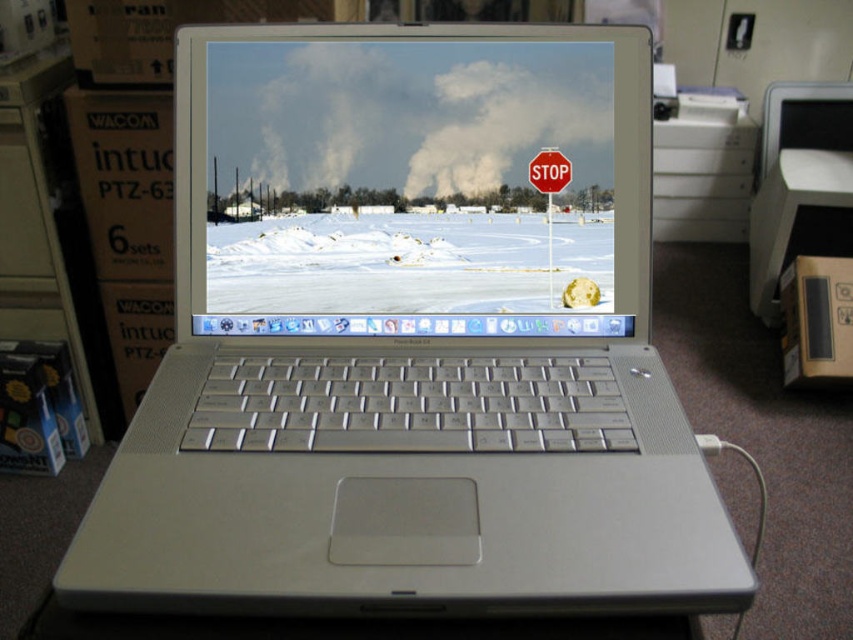
Question: Observing the image, what is the correct spatial positioning of matte plastic screen at center in reference to metallic red stop sign at center?

Choices:
 (A) below
 (B) above

Answer: (A)

Question: Among these points, which one is nearest to the camera?

Choices:
 (A) (556, 230)
 (B) (554, 186)

Answer: (B)

Question: Does matte plastic screen at center come behind metallic red stop sign at center?

Choices:
 (A) yes
 (B) no

Answer: (A)

Question: Is matte plastic screen at center in front of metallic red stop sign at center?

Choices:
 (A) yes
 (B) no

Answer: (B)

Question: Which object appears closest to the camera in this image?

Choices:
 (A) metallic red stop sign at center
 (B) matte plastic screen at center

Answer: (A)